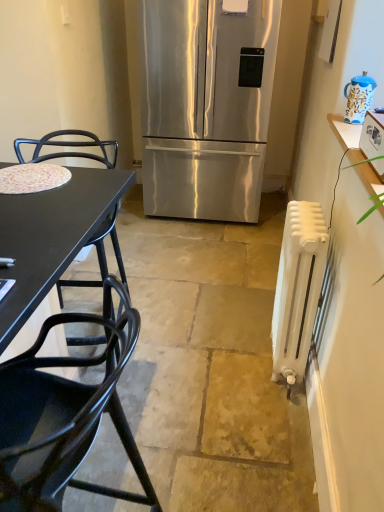
I want to click on vacant area that lies in front of white matte radiator at right, so click(x=268, y=402).